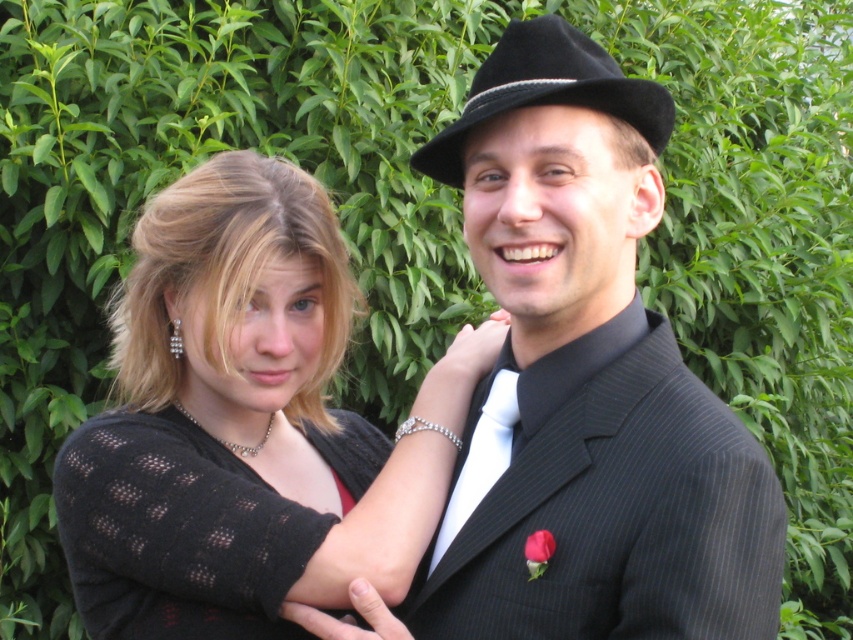
Can you confirm if black textured sweater at left is thinner than white satin tie at center?

Incorrect, black textured sweater at left's width is not less than white satin tie at center's.

Where is `black textured sweater at left`? black textured sweater at left is located at coordinates (247, 422).

In order to click on black textured sweater at left in this screenshot , I will do `click(247, 422)`.

Can you confirm if black textured sweater at left is shorter than black knitted sweater at upper left?

In fact, black textured sweater at left may be taller than black knitted sweater at upper left.

Is point (422, 538) farther from camera compared to point (167, 577)?

That is True.

Identify the location of black textured sweater at left. The height and width of the screenshot is (640, 853). (247, 422).

Which is more to the left, black textured sweater at left or black felt fedora at upper right?

black textured sweater at left is more to the left.

Who is taller, black textured sweater at left or black felt fedora at upper right?

black textured sweater at left

Image resolution: width=853 pixels, height=640 pixels. Identify the location of black textured sweater at left. (247, 422).

The height and width of the screenshot is (640, 853). Find the location of `black textured sweater at left`. black textured sweater at left is located at coordinates (247, 422).